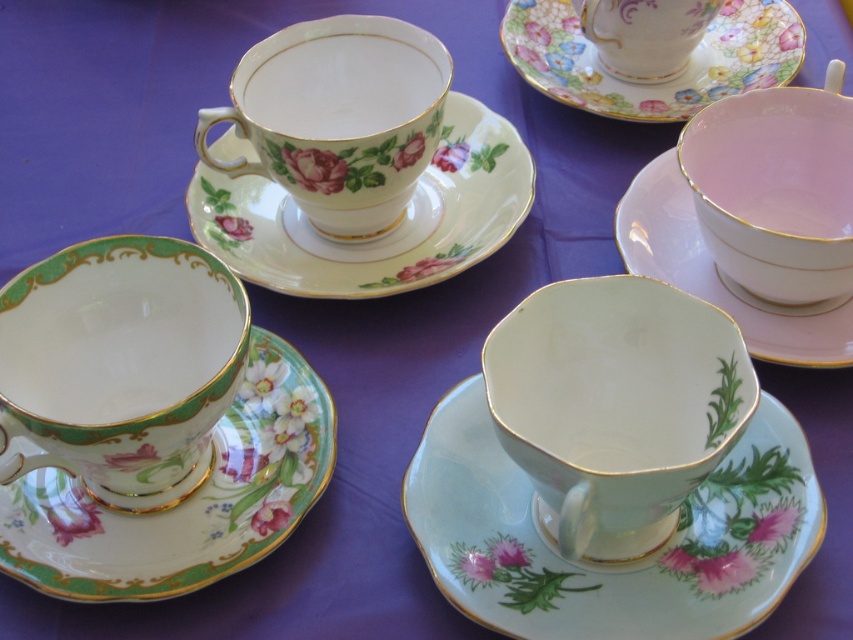
Find the location of `green porcelain teacup at left`. green porcelain teacup at left is located at coordinates (129, 371).

Is green porcelain teacup at left to the right of white porcelain saucer at upper center from the viewer's perspective?

In fact, green porcelain teacup at left is to the left of white porcelain saucer at upper center.

Between point (64, 458) and point (300, 264), which one is positioned behind?

Point (300, 264)

The width and height of the screenshot is (853, 640). What are the coordinates of `green porcelain teacup at left` in the screenshot? It's located at pos(129,371).

Describe the element at coordinates (611, 563) in the screenshot. This screenshot has width=853, height=640. I see `light blue porcelain cup at center` at that location.

Who is taller, light blue porcelain cup at center or green porcelain teacup at left?

green porcelain teacup at left

Find the location of a particular element. The image size is (853, 640). light blue porcelain cup at center is located at coordinates (611, 563).

Can you confirm if matte porcelain teacup at upper center is positioned below white porcelain saucer at upper center?

No.

This screenshot has height=640, width=853. Find the location of `matte porcelain teacup at upper center`. matte porcelain teacup at upper center is located at coordinates (337, 118).

Between point (329, 216) and point (419, 260), which one is positioned behind?

The point (419, 260) is more distant.

Find the location of a particular element. Image resolution: width=853 pixels, height=640 pixels. matte porcelain teacup at upper center is located at coordinates click(x=337, y=118).